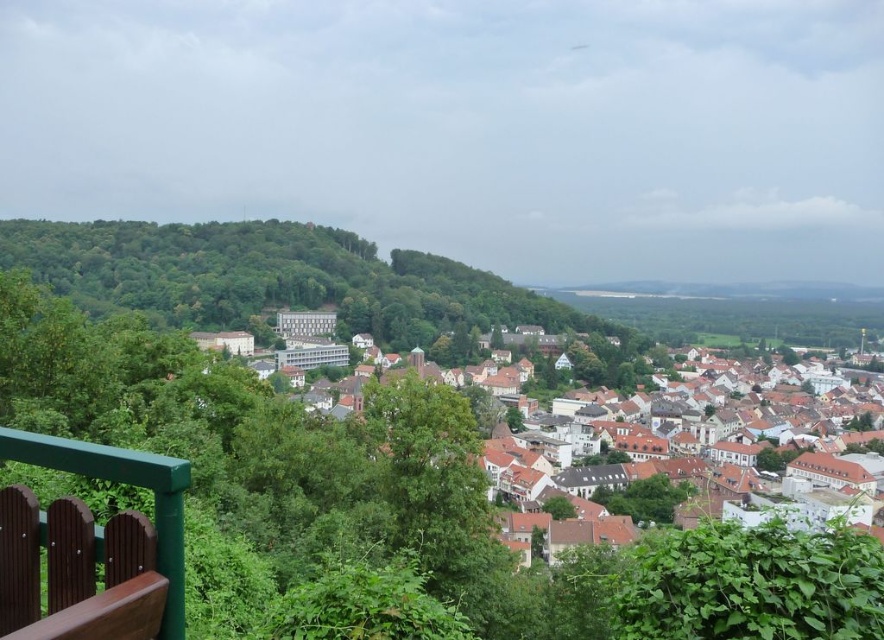
Between white matte building at center and brown wooden rail at lower left, which one appears on the right side from the viewer's perspective?

white matte building at center is more to the right.

Who is more forward, [677,497] or [142,477]?

Point [142,477] is more forward.

Does point (600, 428) come behind point (174, 500)?

Yes, point (600, 428) is farther from viewer.

You are a GUI agent. You are given a task and a screenshot of the screen. Output one action in this format:
    pyautogui.click(x=<x>, y=<y>)
    Task: Click on the white matte building at center
    Image resolution: width=884 pixels, height=640 pixels.
    Given the screenshot: What is the action you would take?
    pyautogui.click(x=683, y=465)